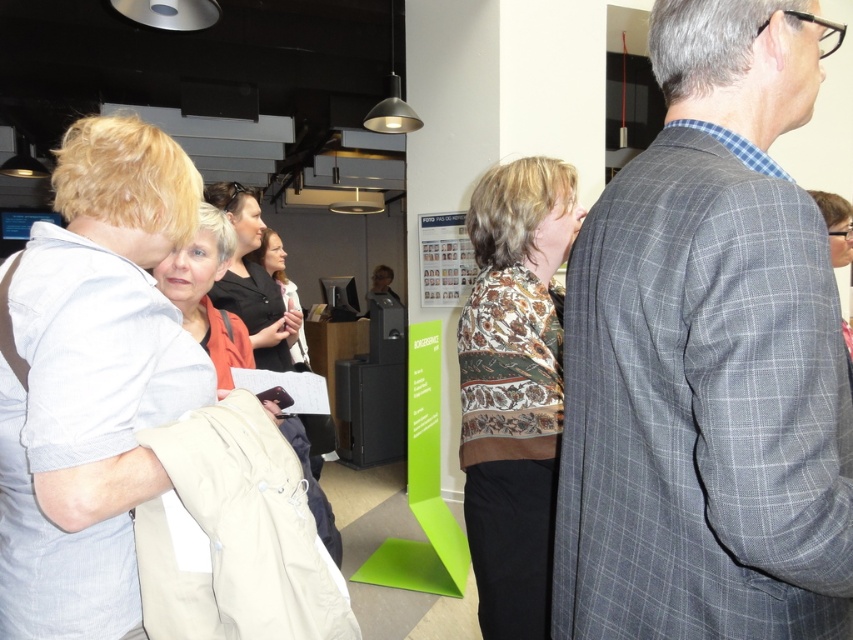
Between matte orange shirt at center and matte black laptop at center, which one appears on the right side from the viewer's perspective?

From the viewer's perspective, matte orange shirt at center appears more on the right side.

Where is `matte orange shirt at center`? matte orange shirt at center is located at coordinates (x=252, y=282).

What do you see at coordinates (252, 282) in the screenshot?
I see `matte orange shirt at center` at bounding box center [252, 282].

In order to click on matte orange shirt at center in this screenshot , I will do `click(252, 282)`.

Does printed fabric blouse at center have a lesser height compared to matte beige coat at center?

No.

Is printed fabric blouse at center above matte beige coat at center?

Correct, printed fabric blouse at center is located above matte beige coat at center.

The height and width of the screenshot is (640, 853). Describe the element at coordinates (514, 387) in the screenshot. I see `printed fabric blouse at center` at that location.

Locate an element on the screen. This screenshot has width=853, height=640. printed fabric blouse at center is located at coordinates (514, 387).

Does gray checkered suit at right appear on the left side of matte beige coat at center?

No, gray checkered suit at right is not to the left of matte beige coat at center.

Which is more to the right, gray checkered suit at right or matte beige coat at center?

From the viewer's perspective, gray checkered suit at right appears more on the right side.

At what (x,y) coordinates should I click in order to perform the action: click on gray checkered suit at right. Please return your answer as a coordinate pair (x, y). This screenshot has width=853, height=640. Looking at the image, I should click on (706, 358).